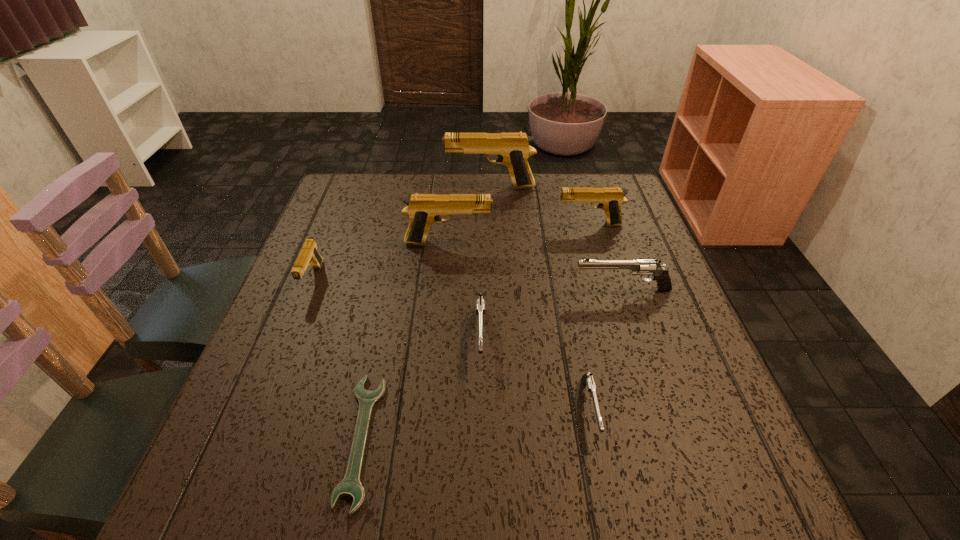
At what (x,y) coordinates should I click in order to perform the action: click on the farthest object. Please return your answer as a coordinate pair (x, y). Looking at the image, I should click on (513, 150).

Locate an element on the screen. The height and width of the screenshot is (540, 960). the biggest tan pistol is located at coordinates (513, 150).

Image resolution: width=960 pixels, height=540 pixels. I want to click on the second biggest tan pistol, so click(423, 210).

Where is `the seventh shortest object`? This screenshot has width=960, height=540. the seventh shortest object is located at coordinates (423, 210).

This screenshot has width=960, height=540. I want to click on the sixth shortest object, so click(610, 199).

At what (x,y) coordinates should I click in order to perform the action: click on the second farthest tan pistol. Please return your answer as a coordinate pair (x, y). This screenshot has width=960, height=540. Looking at the image, I should click on (610, 199).

Find the location of a particular element. the biggest silver pistol is located at coordinates (641, 267).

The height and width of the screenshot is (540, 960). I want to click on the farthest silver pistol, so click(641, 267).

Locate an element on the screen. This screenshot has height=540, width=960. the leftmost tan pistol is located at coordinates (309, 254).

Where is `the smallest tan pistol`? The height and width of the screenshot is (540, 960). the smallest tan pistol is located at coordinates (309, 254).